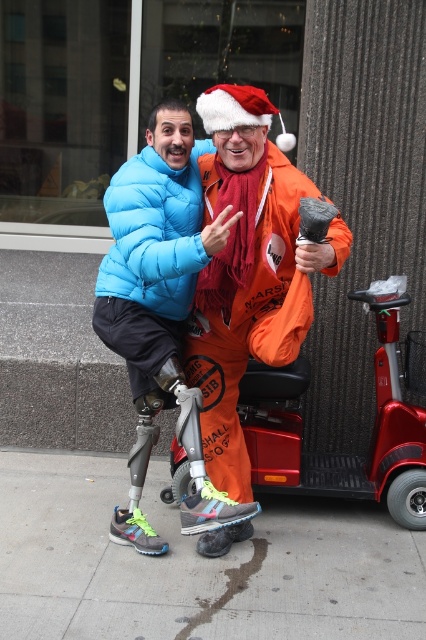
You are standing in front of the two people in the image. Which of the two points, point (222, 332) or point (186, 508), is closer to you?

Point (222, 332) is closer to you because it is further to the viewer than point (186, 508).

You are standing 10 feet away from the point at coordinates point (157, 460). Can you reach the point without moving closer?

The distance of point (157, 460) from viewer is 13.68 feet, so you are currently 10 feet away, which is closer than the point. Therefore, you can reach the point without moving closer.

You are a photographer trying to capture a clear shot of the blue puffer jacket at center. Since the gray concrete sidewalk at center is in the way, can you move the sidewalk to get a better angle?

The gray concrete sidewalk at center is positioned under blue puffer jacket at center, so you cannot move the sidewalk as it is a fixed structure underneath the jacket wearer.